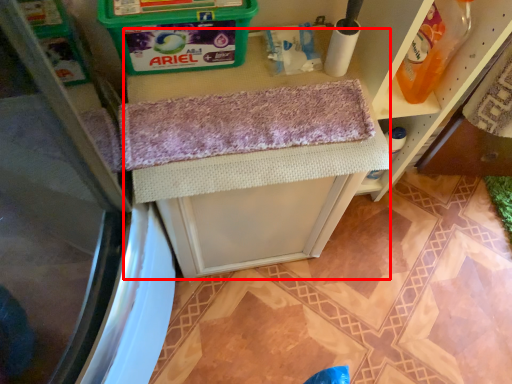
Question: Observing the image, what is the correct spatial positioning of vanity (annotated by the red box) in reference to cleaning product?

Choices:
 (A) left
 (B) right

Answer: (A)